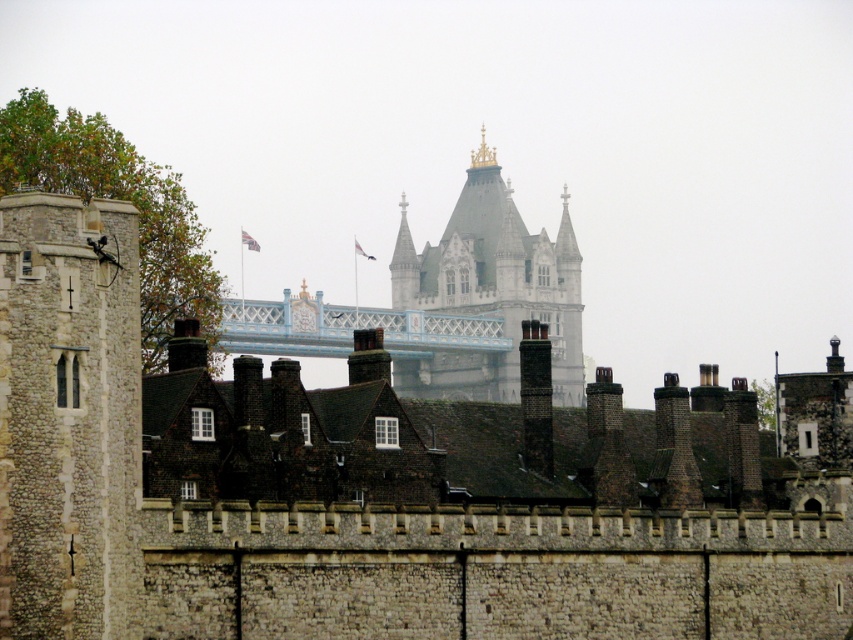
Can you confirm if white stone tower at center is wider than light blue painted metal bridge at center?

No, white stone tower at center is not wider than light blue painted metal bridge at center.

Who is positioned more to the left, white stone tower at center or light blue painted metal bridge at center?

light blue painted metal bridge at center is more to the left.

Between point (529, 244) and point (241, 336), which one is positioned in front?

Point (241, 336)

At what (x,y) coordinates should I click in order to perform the action: click on white stone tower at center. Please return your answer as a coordinate pair (x, y). The height and width of the screenshot is (640, 853). Looking at the image, I should click on (490, 291).